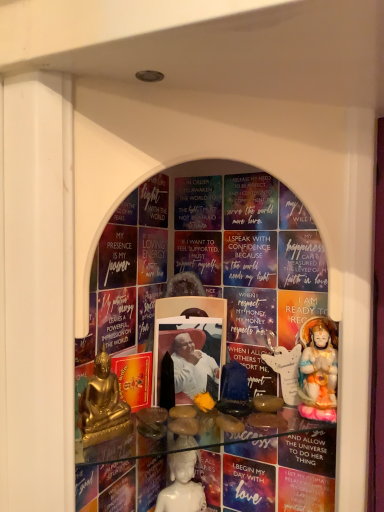
Question: Would you say white porcelain statue at center, the first person when ordered from bottom to top, is inside or outside gold metallic statue at lower left, which is counted as the third person, starting from the back?

Choices:
 (A) outside
 (B) inside

Answer: (A)

Question: In terms of size, does white porcelain statue at center, the first person when ordered from bottom to top, appear bigger or smaller than gold metallic statue at lower left, which is the 2th person in top-to-bottom order?

Choices:
 (A) small
 (B) big

Answer: (A)

Question: Estimate the real-world distances between objects in this image. Which object is farther from the white porcelain statue at center, the second person in the right-to-left sequence?

Choices:
 (A) porcelain statue at right, which is counted as the 2th person, starting from the front
 (B) gold metallic statue at lower left, the 1th person from the left

Answer: (A)

Question: Estimate the real-world distances between objects in this image. Which object is closer to the white porcelain statue at center, which is the second person from left to right?

Choices:
 (A) gold metallic statue at lower left, placed as the first person when sorted from front to back
 (B) porcelain statue at right, the second person viewed from the back

Answer: (A)